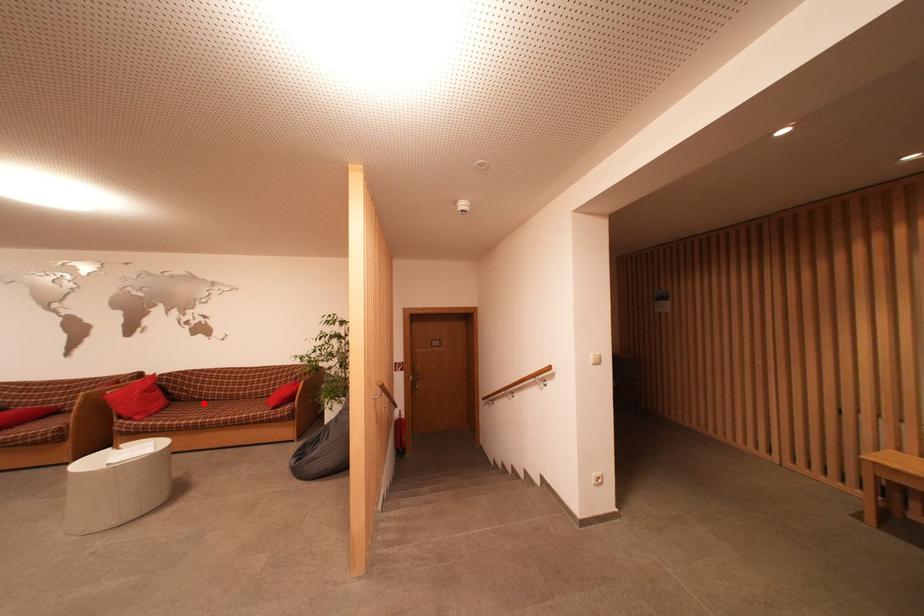
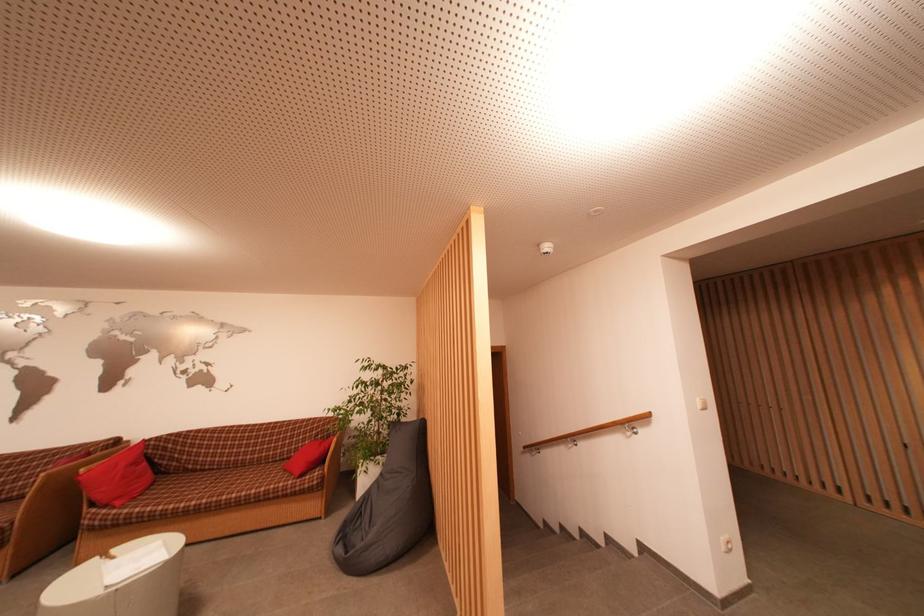
Locate, in the second image, the point that corresponds to the highlighted location in the first image.

(198, 474)